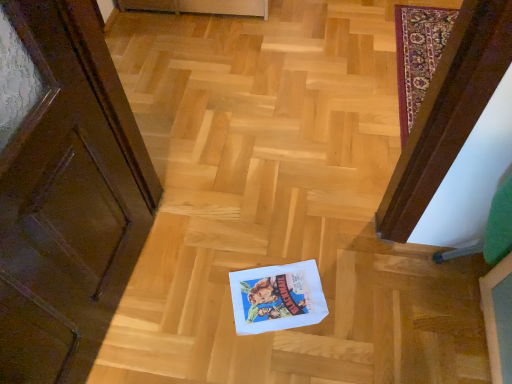
In order to click on vacant space situated on the left part of carpeted mat at upper right in this screenshot , I will do `click(318, 84)`.